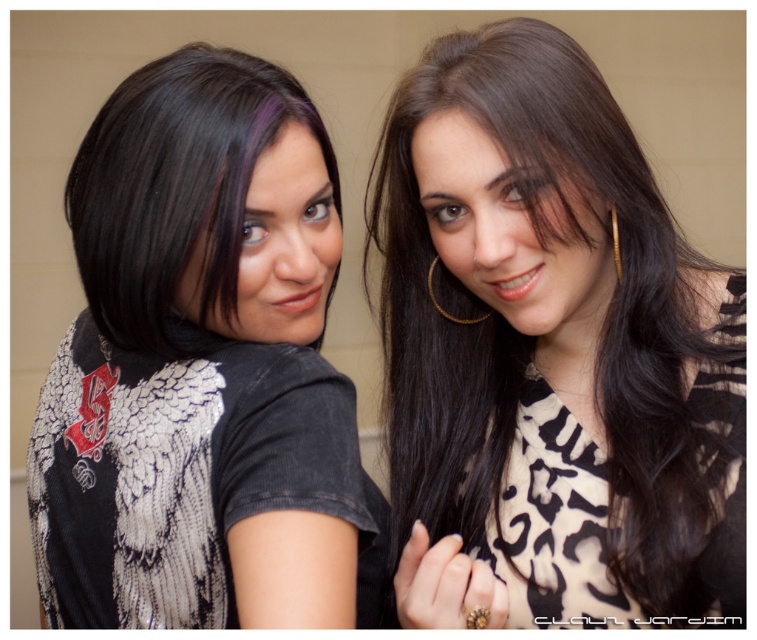
Is black silky hair at left to the right of gold metallic hoop earring at upper center from the viewer's perspective?

In fact, black silky hair at left is to the left of gold metallic hoop earring at upper center.

Is point (248, 68) positioned after point (615, 216)?

That is False.

Identify the location of black silky hair at left. (173, 182).

Based on the photo, is matte black shirt at left shorter than gold metallic hoop earring at upper center?

No.

Who is positioned more to the left, matte black shirt at left or gold metallic hoop earring at upper center?

matte black shirt at left

Between point (79, 490) and point (609, 212), which one is positioned in front?

Point (609, 212) is in front.

Image resolution: width=757 pixels, height=640 pixels. What are the coordinates of `matte black shirt at left` in the screenshot? It's located at (203, 369).

Is the position of matte black shirt at left more distant than that of black silky hair at left?

No.

Does matte black shirt at left have a larger size compared to black silky hair at left?

Yes.

In order to click on matte black shirt at left in this screenshot , I will do `click(203, 369)`.

What are the coordinates of `matte black shirt at left` in the screenshot? It's located at (203, 369).